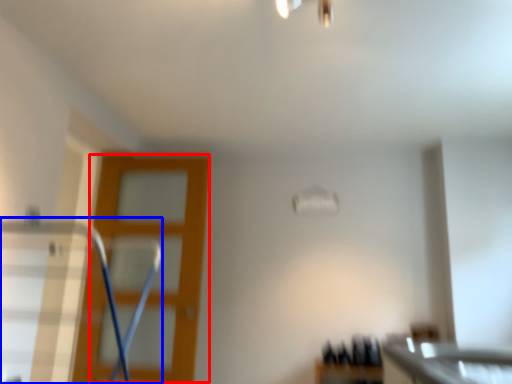
Question: Which point is further to the camera, screen door (highlighted by a red box) or swivel chair (highlighted by a blue box)?

Choices:
 (A) screen door
 (B) swivel chair

Answer: (A)